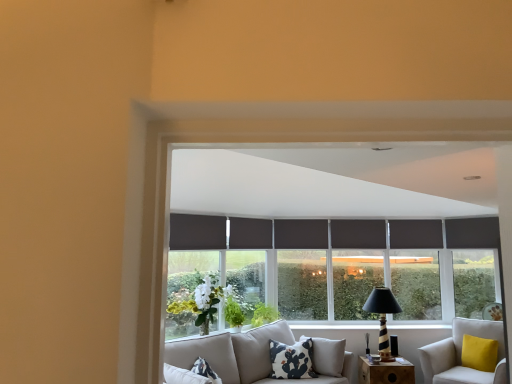
In order to face white fabric studio couch at lower right, should I rotate leftwards or rightwards?

You should rotate right by 27.039 degrees.

What is the approximate height of white matte plant at center, which is counted as the 1th plant, starting from the front?

The height of white matte plant at center, which is counted as the 1th plant, starting from the front, is 28.51 inches.

The width and height of the screenshot is (512, 384). Describe the element at coordinates (264, 314) in the screenshot. I see `green leafy plant at center, the 1th plant from the right` at that location.

From the picture: Measure the distance between dark gray fabric curtain at center, which is counted as the 1th curtain, starting from the back, and camera.

dark gray fabric curtain at center, which is counted as the 1th curtain, starting from the back, and camera are 5.49 meters apart from each other.

Describe the element at coordinates (292, 360) in the screenshot. I see `white cotton pillow with black cactus print at center` at that location.

Looking at this image, in order to face black fabric curtain at center, the 2th curtain from the back, should I rotate leftwards or rightwards?

Rotate left and turn 0.429 degrees.

Where is `black fabric curtain at center, marked as the second curtain in a left-to-right arrangement`? black fabric curtain at center, marked as the second curtain in a left-to-right arrangement is located at coordinates (250, 233).

You are a GUI agent. You are given a task and a screenshot of the screen. Output one action in this format:
    pyautogui.click(x=<x>, y=<y>)
    Task: Click on the dark gray fabric curtain at upper center, arranged as the 3th curtain when viewed from the back
    The width and height of the screenshot is (512, 384).
    Given the screenshot: What is the action you would take?
    pyautogui.click(x=197, y=232)

Considering the sizes of objects wooden at lower right and white matte plant at center, which is counted as the 1th plant, starting from the front, in the image provided, who is shorter, wooden at lower right or white matte plant at center, which is counted as the 1th plant, starting from the front,?

Standing shorter between the two is wooden at lower right.

Measure the distance between wooden at lower right and white matte plant at center, placed as the 2th plant when sorted from back to front.

wooden at lower right and white matte plant at center, placed as the 2th plant when sorted from back to front, are 1.55 meters apart.

Which object is closer to the camera, wooden at lower right or white matte plant at center, the 2th plant from the right?

white matte plant at center, the 2th plant from the right.

Who is taller, white cotton pillow with black cactus print at center or dark gray fabric curtain at center, the third curtain positioned from the left?

white cotton pillow with black cactus print at center.

Is white cotton pillow with black cactus print at center situated inside dark gray fabric curtain at center, placed as the 1th curtain when sorted from right to left, or outside?

white cotton pillow with black cactus print at center is not inside dark gray fabric curtain at center, placed as the 1th curtain when sorted from right to left, it's outside.

Where is `curtain that is the 3rd object above the white cotton pillow with black cactus print at center (from a real-world perspective)`? The height and width of the screenshot is (384, 512). curtain that is the 3rd object above the white cotton pillow with black cactus print at center (from a real-world perspective) is located at coordinates (301, 234).

What's the angular difference between white cotton pillow with black cactus print at center and dark gray fabric curtain at center, the third curtain positioned from the left,'s facing directions?

There is a 6.61-degree angle between the facing directions of white cotton pillow with black cactus print at center and dark gray fabric curtain at center, the third curtain positioned from the left.

Between point (255, 227) and point (382, 288), which one is positioned in front?

Point (255, 227)

Is the position of black fabric curtain at center, marked as the second curtain in a left-to-right arrangement, more distant than that of striped wood table lamp at lower right?

Yes, black fabric curtain at center, marked as the second curtain in a left-to-right arrangement, is behind striped wood table lamp at lower right.

Is black fabric curtain at center, the 2th curtain from the back, aimed at striped wood table lamp at lower right?

No, black fabric curtain at center, the 2th curtain from the back, is not aimed at striped wood table lamp at lower right.

Which object is wider, black fabric curtain at center, marked as the second curtain in a left-to-right arrangement, or striped wood table lamp at lower right?

striped wood table lamp at lower right is wider.

Can you confirm if wooden at lower right is shorter than white fabric studio couch at lower right?

Yes.

Do you think wooden at lower right is within white fabric studio couch at lower right, or outside of it?

wooden at lower right is located beyond the bounds of white fabric studio couch at lower right.

Between wooden at lower right and white fabric studio couch at lower right, which one has smaller width?

With smaller width is wooden at lower right.

Is white fabric studio couch at lower right situated inside dark gray fabric curtain at upper center, the 1th curtain viewed from the front, or outside?

white fabric studio couch at lower right cannot be found inside dark gray fabric curtain at upper center, the 1th curtain viewed from the front.

Is white fabric studio couch at lower right to the right of dark gray fabric curtain at upper center, which is the 3th curtain from right to left, from the viewer's perspective?

Yes, white fabric studio couch at lower right is to the right of dark gray fabric curtain at upper center, which is the 3th curtain from right to left.

Which is in front, point (498, 349) or point (180, 246)?

The point (498, 349) is closer to the camera.

What's the angular difference between white fabric studio couch at lower right and dark gray fabric curtain at upper center, which is the 3th curtain from right to left,'s facing directions?

The angular difference between white fabric studio couch at lower right and dark gray fabric curtain at upper center, which is the 3th curtain from right to left, is 90.5 degrees.

Is green leafy plant at center, the 1th plant from the right, positioned before white matte plant at center, the first plant when ordered from left to right?

That is False.

From the image's perspective, is green leafy plant at center, the 2th plant when ordered from left to right, above or below white matte plant at center, which is counted as the 1th plant, starting from the front?

Clearly, from the image's perspective, green leafy plant at center, the 2th plant when ordered from left to right, is below white matte plant at center, which is counted as the 1th plant, starting from the front.

Which is in front, point (254, 314) or point (209, 282)?

The point (209, 282) is in front.

Is white fabric studio couch at lower right directly adjacent to black fabric curtain at center, marked as the second curtain in a left-to-right arrangement?

They are not placed beside each other.

From the image's perspective, is white fabric studio couch at lower right above or below black fabric curtain at center, which appears as the second curtain when viewed from the front?

white fabric studio couch at lower right is below black fabric curtain at center, which appears as the second curtain when viewed from the front.

Which object is closer to the camera taking this photo, white fabric studio couch at lower right or black fabric curtain at center, marked as the second curtain in a right-to-left arrangement?

Positioned in front is white fabric studio couch at lower right.

In order to click on table behind the white matte plant at center, the 2th plant from the right in this screenshot , I will do `click(385, 372)`.

Find the location of a particular element. This screenshot has height=384, width=512. the 3rd curtain directly above the white cotton pillow with black cactus print at center (from a real-world perspective) is located at coordinates pos(301,234).

Considering their positions, is striped wood table lamp at lower right positioned closer to white matte plant at center, the first plant when ordered from left to right, than green leafy plant at center, the first plant in the back-to-front sequence?

Based on the image, green leafy plant at center, the first plant in the back-to-front sequence, appears to be nearer to white matte plant at center, the first plant when ordered from left to right.

From the picture: From the image, which object appears to be nearer to white fabric studio couch at lower right, white cotton pillow with black cactus print at center or dark gray fabric curtain at center, which is counted as the 1th curtain, starting from the back?

white cotton pillow with black cactus print at center lies closer to white fabric studio couch at lower right than the other object.

Estimate the real-world distances between objects in this image. Which object is further from green leafy plant at center, the first plant in the back-to-front sequence, white cotton pillow with black cactus print at center or striped wood table lamp at lower right?

striped wood table lamp at lower right.

Looking at the image, which one is located closer to white cotton pillow with black cactus print at center, dark gray fabric curtain at center, placed as the 1th curtain when sorted from right to left, or striped wood table lamp at lower right?

Based on the image, striped wood table lamp at lower right appears to be nearer to white cotton pillow with black cactus print at center.

When comparing their distances from white matte plant at center, the 2th plant from the right, does striped wood table lamp at lower right or white cotton pillow with black cactus print at center seem closer?

white cotton pillow with black cactus print at center is positioned closer to the anchor white matte plant at center, the 2th plant from the right.

Looking at the image, which one is located closer to white fabric studio couch at lower right, green leafy plant at center, the 1th plant from the right, or black fabric curtain at center, marked as the second curtain in a left-to-right arrangement?

green leafy plant at center, the 1th plant from the right, is closer to white fabric studio couch at lower right.

Estimate the real-world distances between objects in this image. Which object is closer to white matte plant at center, which is counted as the 1th plant, starting from the front, green leafy plant at center, arranged as the second plant when viewed from the front, or white cotton pillow with black cactus print at center?

The object closer to white matte plant at center, which is counted as the 1th plant, starting from the front, is green leafy plant at center, arranged as the second plant when viewed from the front.

When comparing their distances from white cotton pillow with black cactus print at center, does dark gray fabric curtain at center, the third curtain positioned from the left, or white matte plant at center, which is counted as the 1th plant, starting from the front, seem further?

dark gray fabric curtain at center, the third curtain positioned from the left, is positioned further to the anchor white cotton pillow with black cactus print at center.

The height and width of the screenshot is (384, 512). Find the location of `table lamp between dark gray fabric curtain at upper center, the 1th curtain viewed from the front, and white fabric studio couch at lower right`. table lamp between dark gray fabric curtain at upper center, the 1th curtain viewed from the front, and white fabric studio couch at lower right is located at coordinates (382, 317).

Where is `curtain between green leafy plant at center, the 1th plant from the right, and striped wood table lamp at lower right from left to right`? curtain between green leafy plant at center, the 1th plant from the right, and striped wood table lamp at lower right from left to right is located at coordinates (301, 234).

This screenshot has width=512, height=384. I want to click on plant between white cotton pillow with black cactus print at center and dark gray fabric curtain at center, the third curtain positioned from the left, from front to back, so click(x=264, y=314).

This screenshot has height=384, width=512. I want to click on table lamp between green leafy plant at center, arranged as the second plant when viewed from the front, and white fabric studio couch at lower right, in the horizontal direction, so click(382, 317).